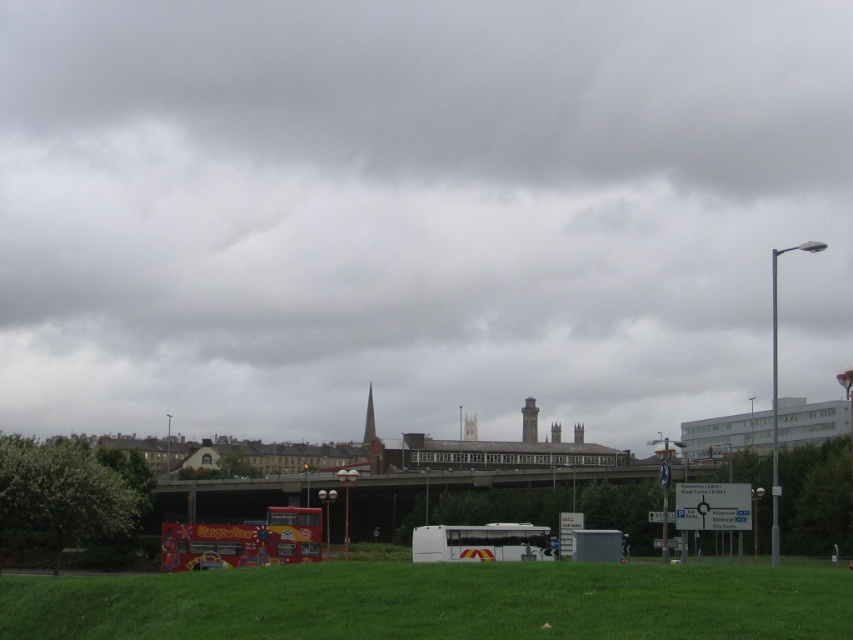
Is gray cloudy sky at upper center above green grass at lower center?

Yes, gray cloudy sky at upper center is above green grass at lower center.

Which is below, gray cloudy sky at upper center or green grass at lower center?

green grass at lower center is below.

Describe the element at coordinates (416, 211) in the screenshot. I see `gray cloudy sky at upper center` at that location.

Locate an element on the screen. The width and height of the screenshot is (853, 640). gray cloudy sky at upper center is located at coordinates (416, 211).

Is green grass at lower center closer to camera compared to white matte bus at center?

Yes, green grass at lower center is in front of white matte bus at center.

Is point (679, 602) positioned in front of point (457, 536)?

Yes.

At what (x,y) coordinates should I click in order to perform the action: click on green grass at lower center. Please return your answer as a coordinate pair (x, y). Looking at the image, I should click on (436, 602).

Does gray cloudy sky at upper center appear on the left side of white matte bus at center?

Correct, you'll find gray cloudy sky at upper center to the left of white matte bus at center.

Does gray cloudy sky at upper center have a greater width compared to white matte bus at center?

Correct, the width of gray cloudy sky at upper center exceeds that of white matte bus at center.

Where is `gray cloudy sky at upper center`? Image resolution: width=853 pixels, height=640 pixels. gray cloudy sky at upper center is located at coordinates (416, 211).